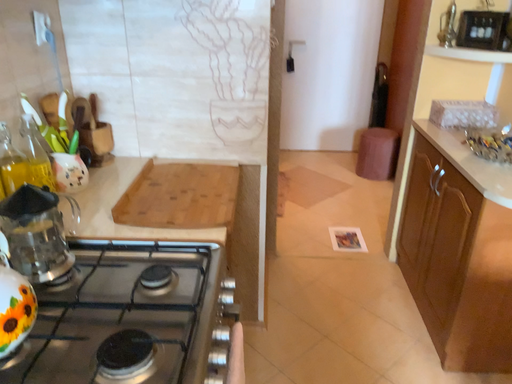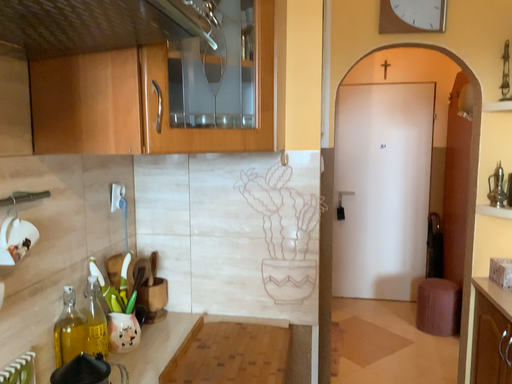
Question: Which way did the camera rotate in the video?

Choices:
 (A) rotated right
 (B) rotated left

Answer: (B)